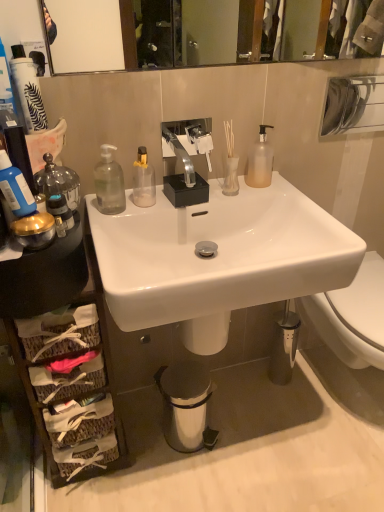
This screenshot has width=384, height=512. Find the location of `vacant space in white glossy sink at center, which is the 2th sink from top to bottom (from a real-world perspective)`. vacant space in white glossy sink at center, which is the 2th sink from top to bottom (from a real-world perspective) is located at coordinates (219, 439).